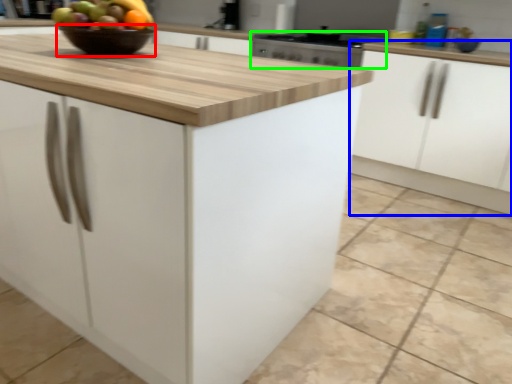
Question: Estimate the real-world distances between objects in this image. Which object is farther from glass bowl (highlighted by a red box), cabinetry (highlighted by a blue box) or kitchen appliance (highlighted by a green box)?

Choices:
 (A) cabinetry
 (B) kitchen appliance

Answer: (A)